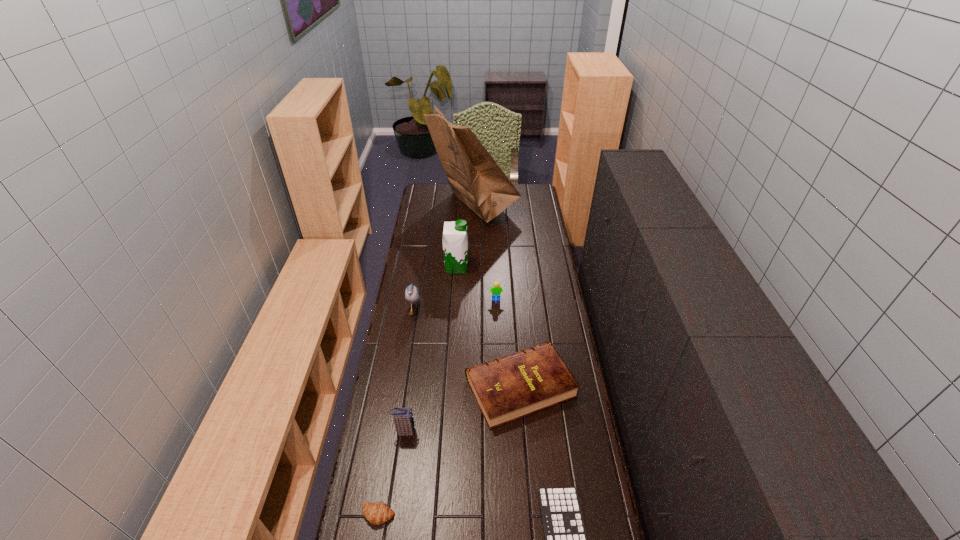
Locate an element on the screen. Image resolution: width=960 pixels, height=540 pixels. crescent roll at the left edge is located at coordinates (377, 513).

The image size is (960, 540). I want to click on grocery bag that is at the right edge, so click(475, 178).

Locate an element on the screen. The height and width of the screenshot is (540, 960). hardback book that is at the right edge is located at coordinates click(x=508, y=388).

Identify the location of object at the far left corner. This screenshot has width=960, height=540. (475, 178).

Where is `object that is positioned at the far right corner`? object that is positioned at the far right corner is located at coordinates (475, 178).

Identify the location of vacant position at the left edge of the desktop. [428, 252].

The height and width of the screenshot is (540, 960). In the image, there is a desktop. What are the coordinates of `free space at the right edge` in the screenshot? It's located at (575, 375).

I want to click on free space at the far right corner of the desktop, so click(x=533, y=187).

Identify the location of vacant area between the hardback book and the Lego. The height and width of the screenshot is (540, 960). click(508, 343).

Find the location of `unoccupied position between the Lego and the sixth tallest object`. unoccupied position between the Lego and the sixth tallest object is located at coordinates (508, 343).